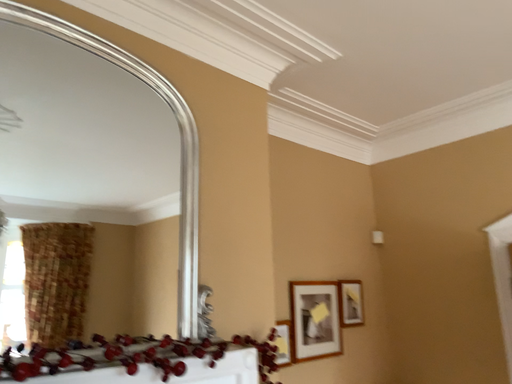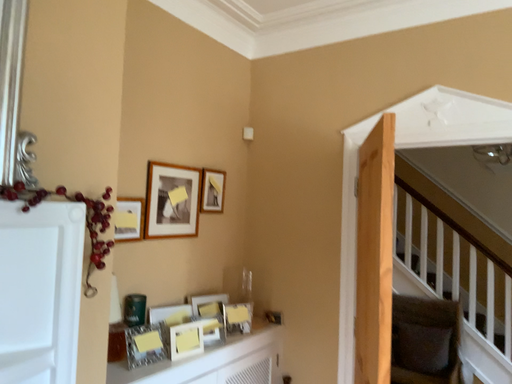
Question: Which way did the camera rotate in the video?

Choices:
 (A) rotated downward
 (B) rotated upward

Answer: (A)